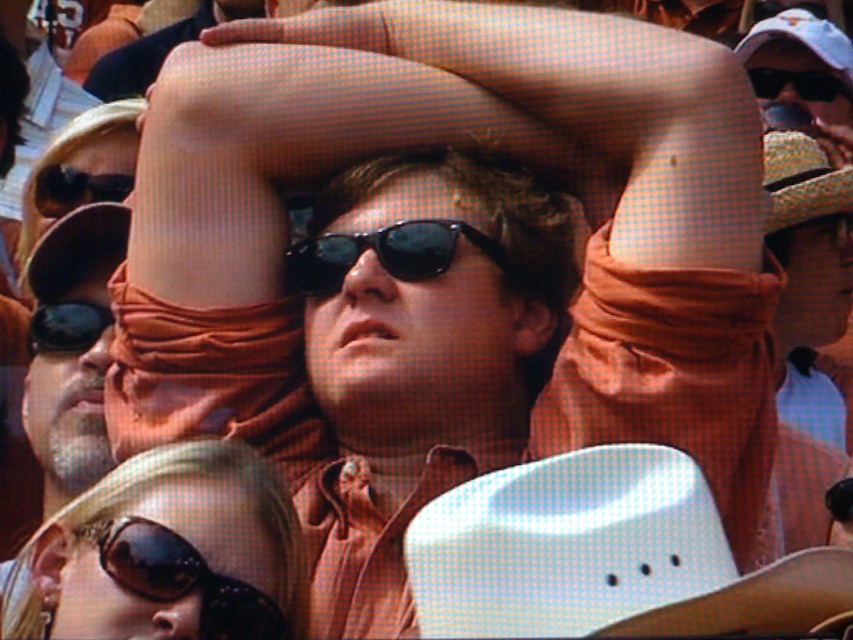
Does black plastic sunglasses at upper left come behind matte black goggles at center?

Yes, black plastic sunglasses at upper left is behind matte black goggles at center.

Which is in front, point (107, 192) or point (47, 333)?

Point (47, 333) is in front.

Identify the location of black plastic sunglasses at upper left. Image resolution: width=853 pixels, height=640 pixels. (76, 188).

Based on the photo, who is positioned more to the right, matte brown shirt at center or matte black goggles at center?

From the viewer's perspective, matte brown shirt at center appears more on the right side.

Does point (68, 225) lie behind point (47, 342)?

Yes, it is.

Who is more forward, (91,212) or (56,324)?

Point (56,324) is more forward.

Identify the location of matte brown shirt at center. The width and height of the screenshot is (853, 640). (71, 348).

Image resolution: width=853 pixels, height=640 pixels. Identify the location of sunglasses at lower left. (167, 554).

Is point (273, 468) in front of point (73, 312)?

Yes, point (273, 468) is in front of point (73, 312).

You are a GUI agent. You are given a task and a screenshot of the screen. Output one action in this format:
    pyautogui.click(x=<x>, y=<y>)
    Task: Click on the sunglasses at lower left
    Image resolution: width=853 pixels, height=640 pixels.
    Given the screenshot: What is the action you would take?
    pos(167,554)